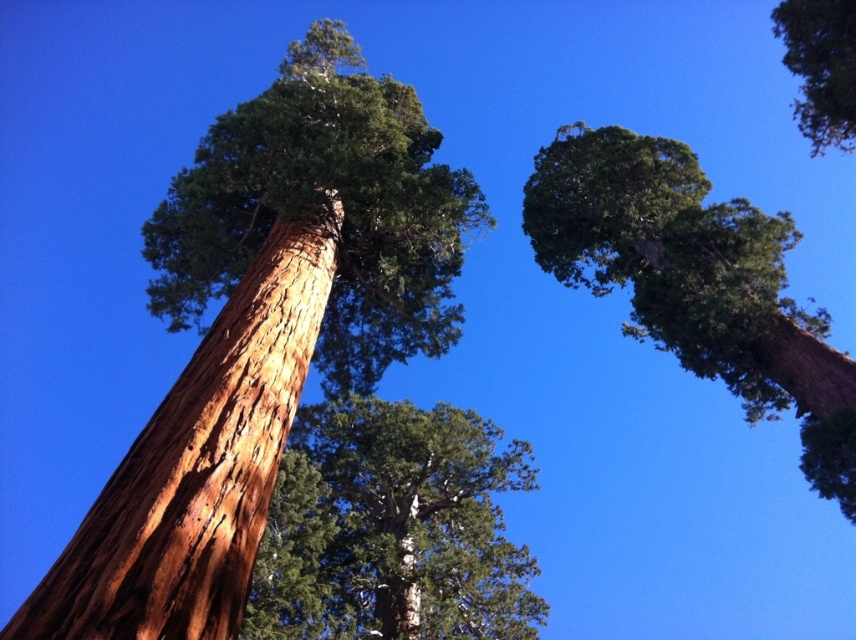
You are a bird looking for a nesting spot. You see the rough bark tree at center and the green rough bark tree at upper right. Which tree has a wider trunk for building your nest?

The rough bark tree at center has a wider trunk than the green rough bark tree at upper right, so it would be better for building a nest.